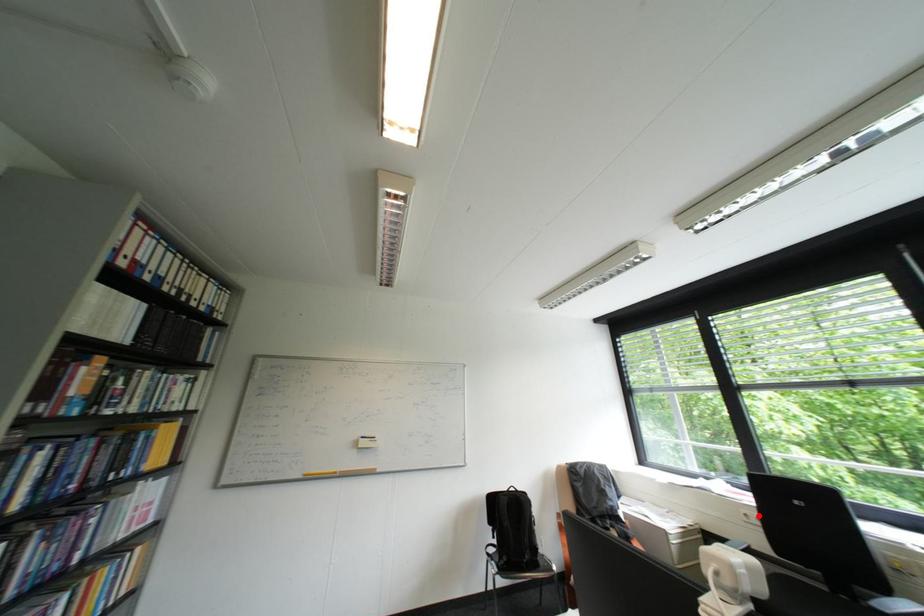
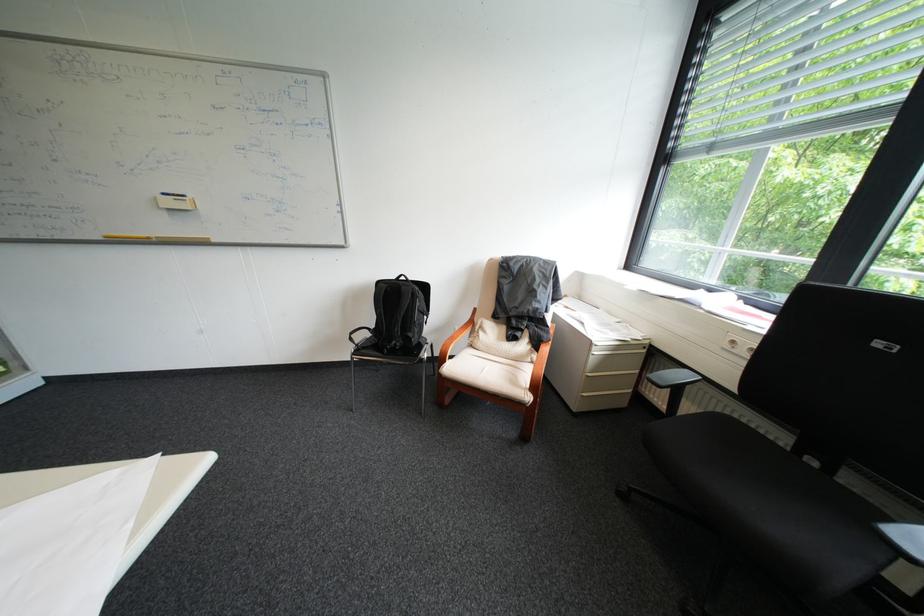
In the second image, find the point that corresponds to the highlighted location in the first image.

(746, 342)